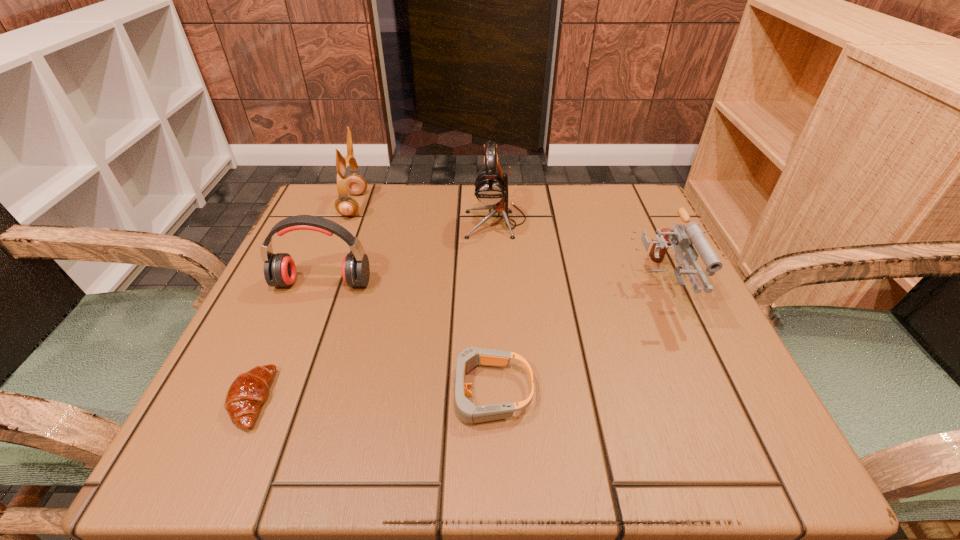
The width and height of the screenshot is (960, 540). I want to click on object that ranks as the third closest to the nearest earphone, so click(x=491, y=186).

Identify which earphone is the second closest to the goggles. Please provide its 2D coordinates. Your answer should be formatted as a tuple, i.e. [(x, y)], where the tuple contains the x and y coordinates of a point satisfying the conditions above.

[(491, 186)]

Where is `earphone that is the second nearest to the nearest earphone`? The image size is (960, 540). earphone that is the second nearest to the nearest earphone is located at coordinates coord(491,186).